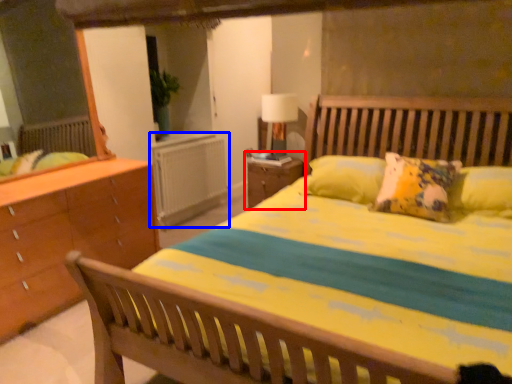
Question: Which of the following is the closest to the observer, nightstand (highlighted by a red box) or radiator (highlighted by a blue box)?

Choices:
 (A) nightstand
 (B) radiator

Answer: (A)